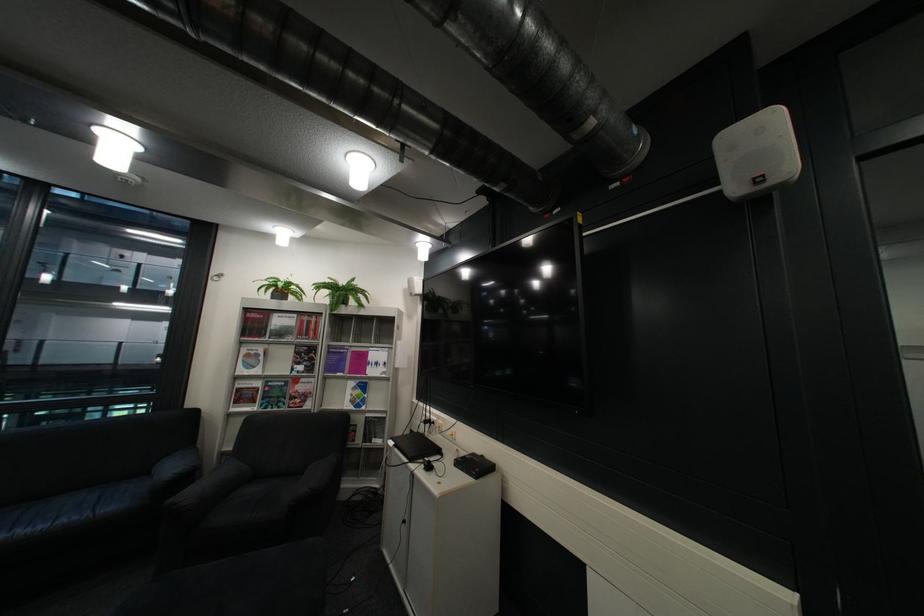
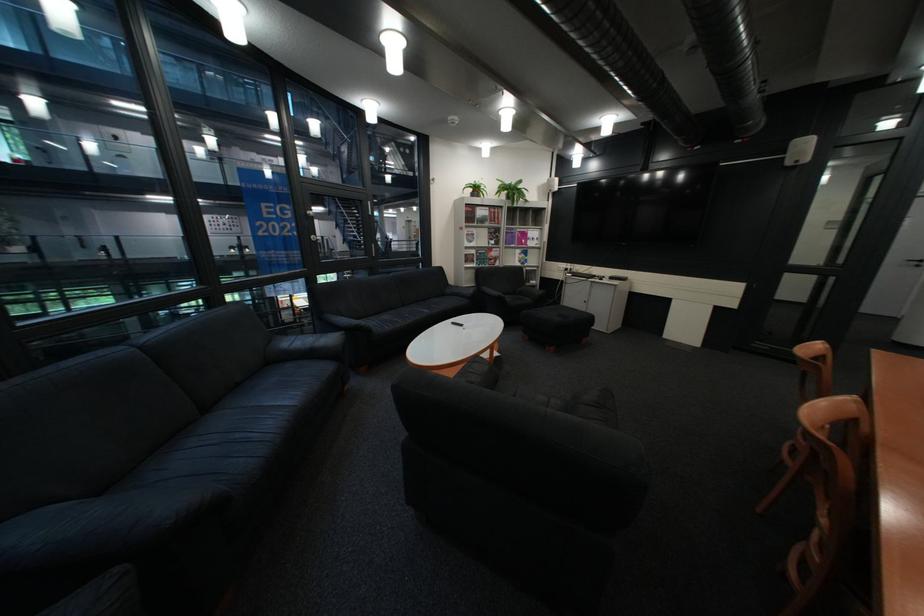
In the second image, find the point that corresponds to [287,346] in the first image.

(492, 229)